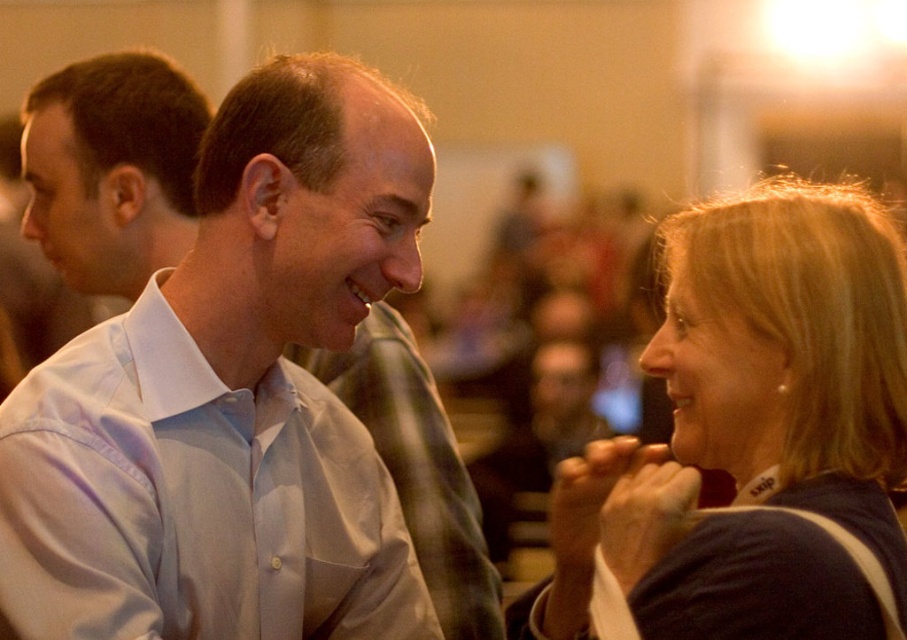
Question: Can you confirm if blonde hair at upper right is bigger than white cotton dress shirt at center?

Choices:
 (A) no
 (B) yes

Answer: (B)

Question: Is blonde hair at upper right wider than white cotton dress shirt at center?

Choices:
 (A) no
 (B) yes

Answer: (B)

Question: Which object is farther from the camera taking this photo?

Choices:
 (A) white cotton dress shirt at center
 (B) blonde hair at upper right

Answer: (A)

Question: Which object appears farthest from the camera in this image?

Choices:
 (A) white cotton dress shirt at center
 (B) blonde hair at upper right

Answer: (A)

Question: Observing the image, what is the correct spatial positioning of blonde hair at upper right in reference to white cotton dress shirt at center?

Choices:
 (A) left
 (B) right

Answer: (B)